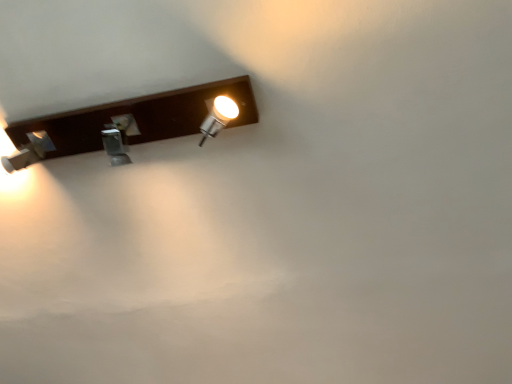
Question: Should I look upward or downward to see matte brown light fixture at upper left?

Choices:
 (A) up
 (B) down

Answer: (A)